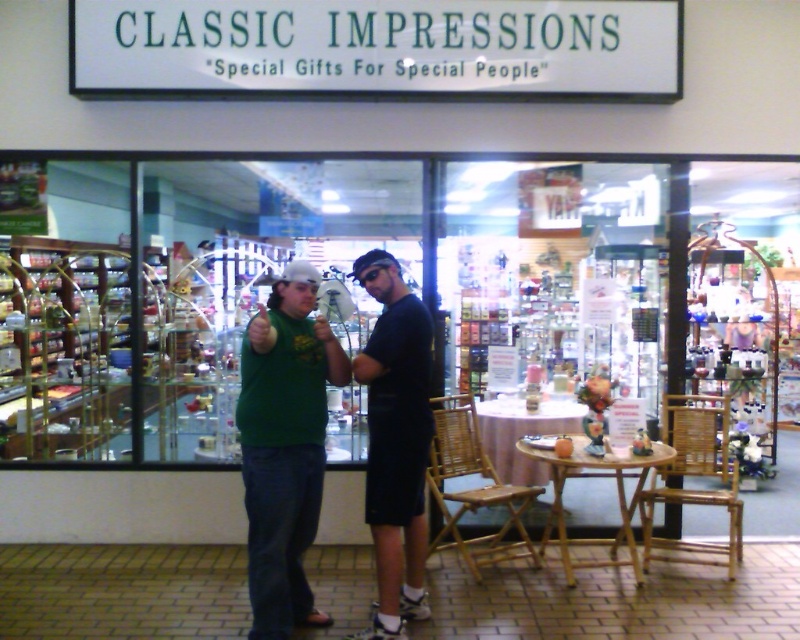
Question: Can you confirm if green matte t-shirt at center is positioned to the left of black matte shirt at center?

Choices:
 (A) no
 (B) yes

Answer: (B)

Question: Which object appears closest to the camera in this image?

Choices:
 (A) green matte t-shirt at center
 (B) black matte shirt at center

Answer: (A)

Question: Which point is farther to the camera?

Choices:
 (A) green matte t-shirt at center
 (B) black matte shirt at center

Answer: (B)

Question: From the image, what is the correct spatial relationship of green matte t-shirt at center in relation to black matte shirt at center?

Choices:
 (A) right
 (B) left

Answer: (B)

Question: Which point is farther from the camera taking this photo?

Choices:
 (A) (304, 376)
 (B) (378, 371)

Answer: (B)

Question: Is green matte t-shirt at center thinner than black matte shirt at center?

Choices:
 (A) no
 (B) yes

Answer: (A)